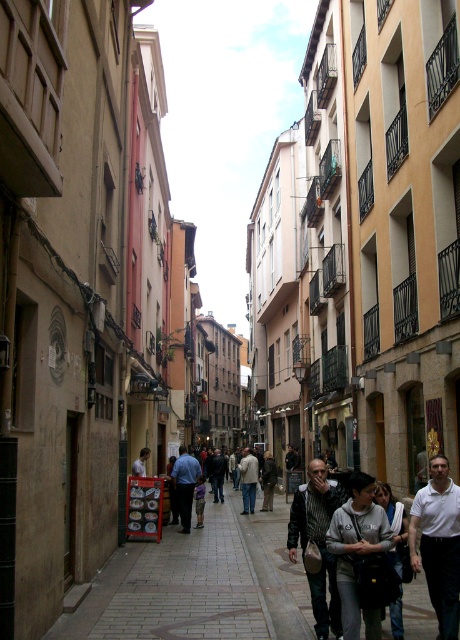
Question: Is the position of blue shirt at center more distant than that of light gray jacket at center?

Choices:
 (A) no
 (B) yes

Answer: (A)

Question: From the image, what is the correct spatial relationship of paved stone sidewalk at center in relation to dark brown leather jacket at center?

Choices:
 (A) right
 (B) left

Answer: (B)

Question: Which of the following is the closest to the observer?

Choices:
 (A) (293, 504)
 (B) (189, 486)
 (C) (425, 496)

Answer: (C)

Question: Can you confirm if dark brown leather jacket at center is wider than light gray jacket at center?

Choices:
 (A) yes
 (B) no

Answer: (B)

Question: Which of the following is the closest to the observer?

Choices:
 (A) (288, 593)
 (B) (185, 504)

Answer: (A)

Question: Which point appears farthest from the camera in this image?

Choices:
 (A) (327, 483)
 (B) (394, 573)
 (C) (183, 465)

Answer: (C)